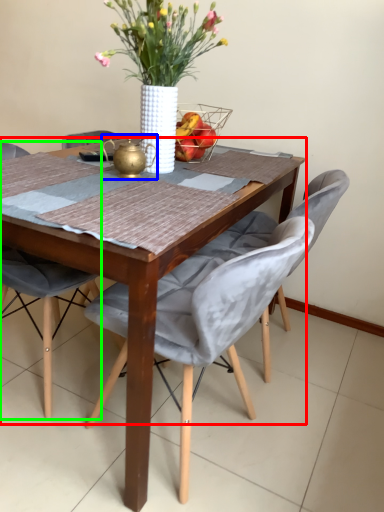
Question: Which is farther away from round table (highlighted by a red box)? tea pot (highlighted by a blue box) or chair (highlighted by a green box)?

Choices:
 (A) tea pot
 (B) chair

Answer: (B)